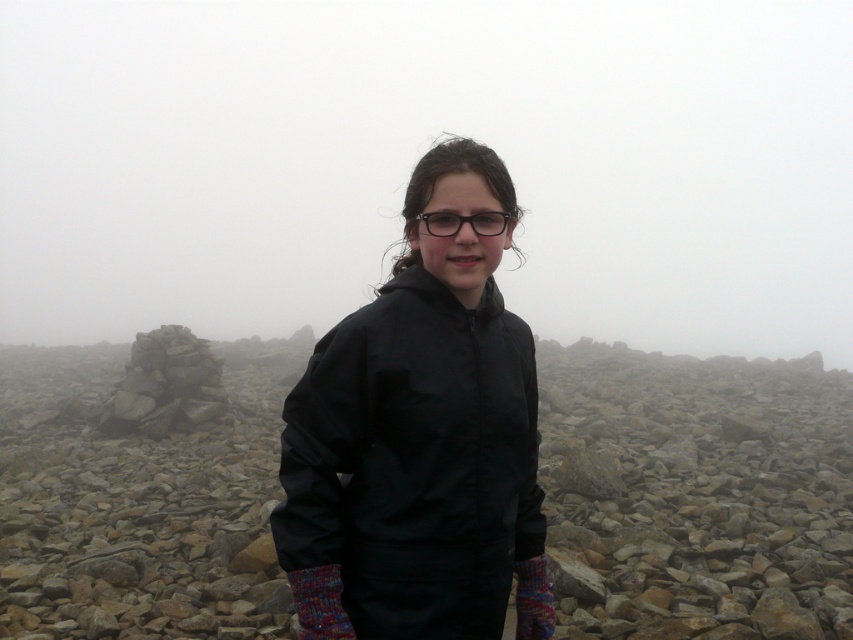
You are a hiker who wants to adjust your glasses without touching your jacket. Since both the black fabric jacket at center and the transparent plastic glasses at center are in front of you, which one should you move first?

The transparent plastic glasses at center are on the left side of the black fabric jacket at center, so you should move the transparent plastic glasses at center first to avoid contact with the jacket.